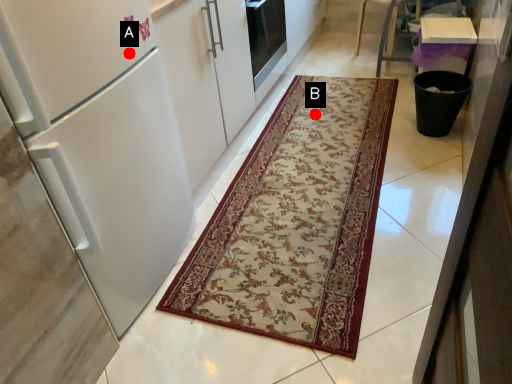
Question: Two points are circled on the image, labeled by A and B beside each circle. Which point is farther from the camera taking this photo?

Choices:
 (A) A is further
 (B) B is further

Answer: (B)